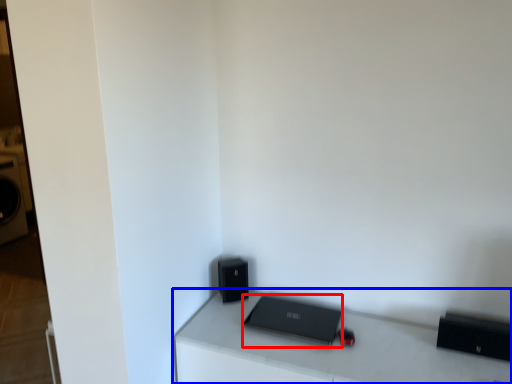
Question: Which object appears closest to the camera in this image, laptop (highlighted by a red box) or furniture (highlighted by a blue box)?

Choices:
 (A) laptop
 (B) furniture

Answer: (B)